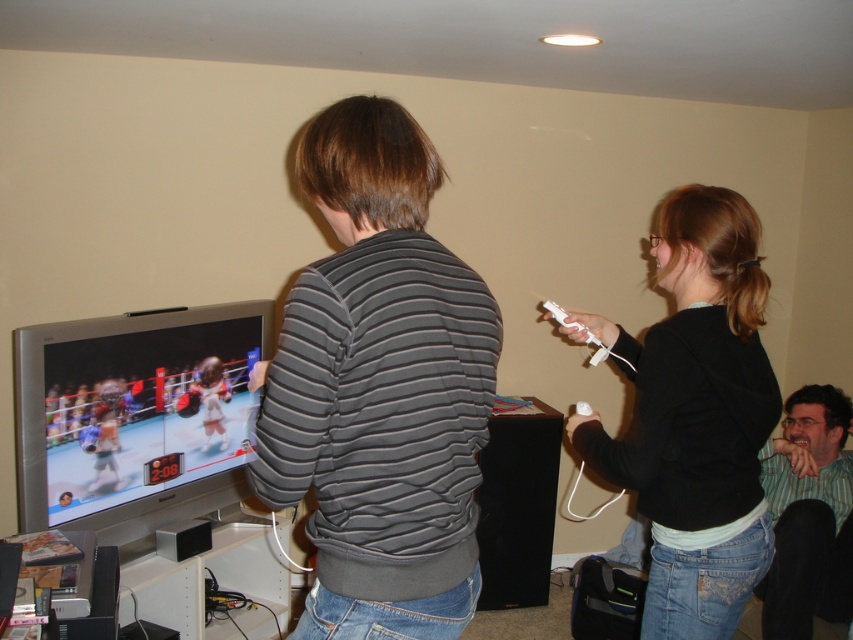
You are a fashion designer observing the indoor scene. You need to decide which clothing item to recommend for a client who prefers looser fits. Based on the image, which item between the striped cotton shirt at center and the dark gray striped sweater at center is wider?

The striped cotton shirt at center is wider than the dark gray striped sweater at center, so it would be the better recommendation for a looser fit.

You are a photographer who wants to take a photo of the dark gray striped sweater at center. The camera you are using has a minimum focusing distance of 3 feet. Can you take the photo without moving either the camera or the sweater?

The dark gray striped sweater at center and camera are 3.50 feet apart, which is greater than the minimum focusing distance of 3 feet. Therefore, you can take the photo without moving either the camera or the sweater.

From the picture: You are designing a new game controller and need to consider the size of the sleeves of the participants. Which participant is wearing a thinner sleeve, the one in the dark gray striped sweater at center or the green striped shirt at lower right?

The dark gray striped sweater at center has thinner sleeves than the green striped shirt at lower right according to the description.